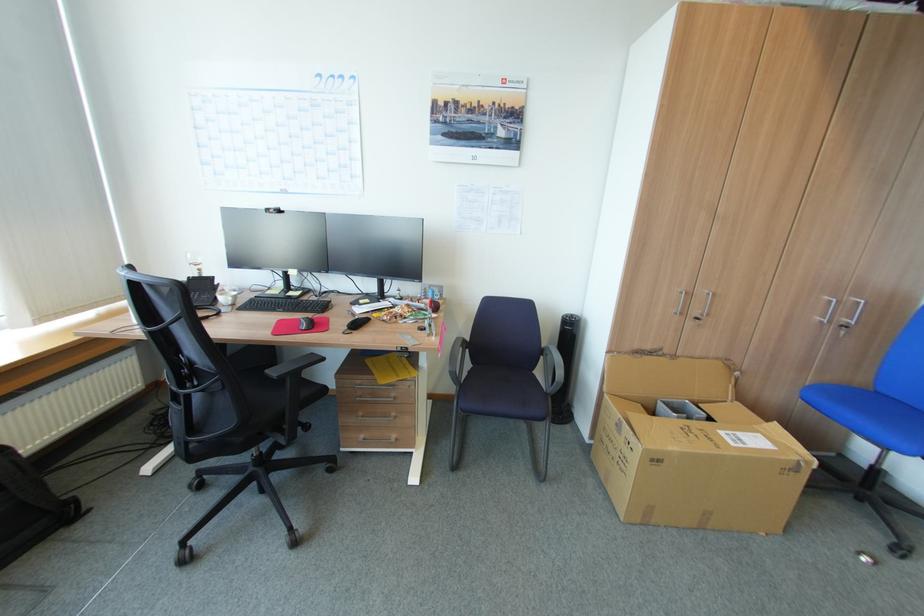
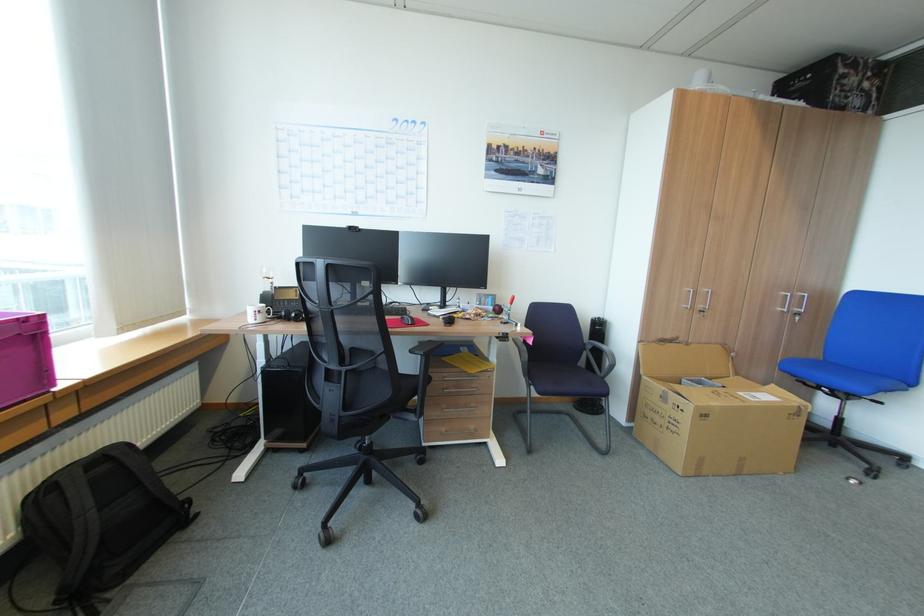
In the second image, find the point that corresponds to [807,399] in the first image.

(786, 370)